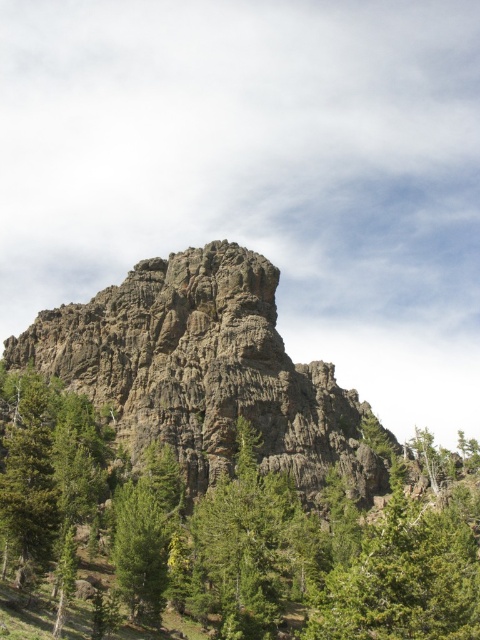
Does green textured tree at center appear on the right side of rugged stone rock at center?

No, green textured tree at center is not to the right of rugged stone rock at center.

Is green textured tree at center taller than rugged stone rock at center?

In fact, green textured tree at center may be shorter than rugged stone rock at center.

Describe the element at coordinates (294, 554) in the screenshot. I see `green textured tree at center` at that location.

Where is `green textured tree at center`? The image size is (480, 640). green textured tree at center is located at coordinates (294, 554).

Which is above, green textured tree at center or green matte tree at lower left?

green textured tree at center

Who is positioned more to the left, green textured tree at center or green matte tree at lower left?

green matte tree at lower left

Who is more distant from viewer, (180, 476) or (112, 550)?

The point (180, 476) is more distant.

The width and height of the screenshot is (480, 640). In order to click on green textured tree at center in this screenshot , I will do `click(294, 554)`.

Can you confirm if rugged stone rock at center is wider than green matte tree at lower left?

Indeed, rugged stone rock at center has a greater width compared to green matte tree at lower left.

Can you confirm if rugged stone rock at center is taller than green matte tree at lower left?

Yes, rugged stone rock at center is taller than green matte tree at lower left.

Find the location of a particular element. rugged stone rock at center is located at coordinates (206, 371).